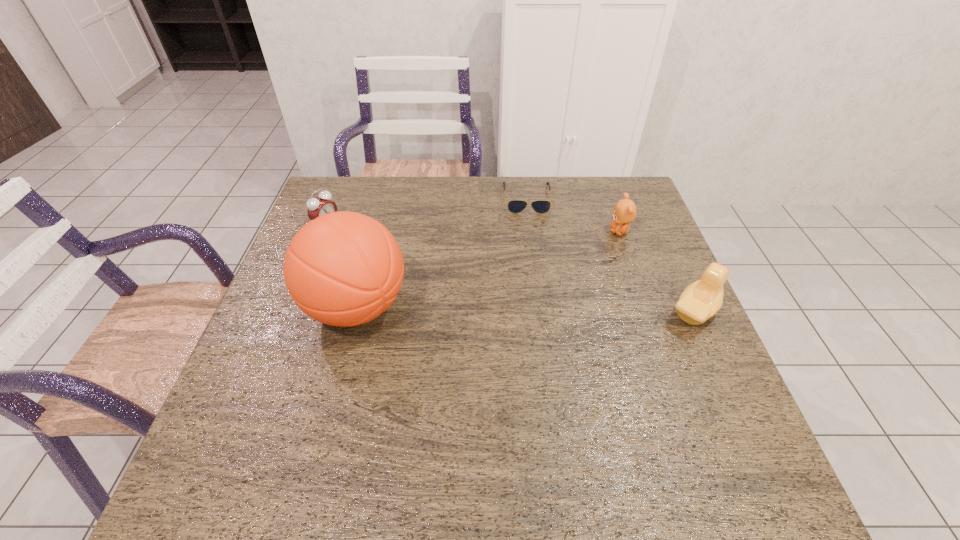
Identify the location of vacant space on the desktop that is between the tallest object and the rightmost object and is positioned on the face of the second object from right to left. The image size is (960, 540). (532, 309).

Find the location of `vacant space on the desktop that is between the tallest object and the duck and is positioned on the front-facing side of the shortest object`. vacant space on the desktop that is between the tallest object and the duck and is positioned on the front-facing side of the shortest object is located at coordinates (539, 309).

Where is `vacant space on the desktop that is between the tallest object and the duck and is positioned on the clock face of the alarm clock`? vacant space on the desktop that is between the tallest object and the duck and is positioned on the clock face of the alarm clock is located at coordinates (502, 309).